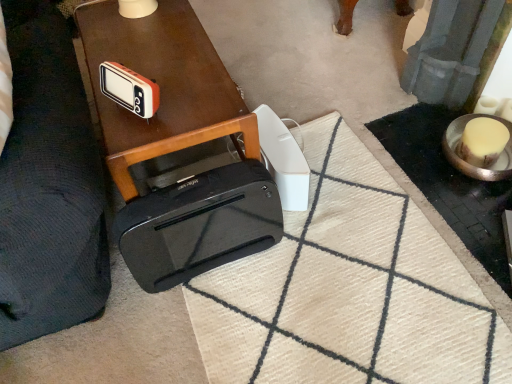
At what (x,y) coordinates should I click in order to perform the action: click on unoccupied space behind orange plastic radio at upper left, acting as the 1th gadget starting from the front. Please return your answer as a coordinate pair (x, y). This screenshot has width=512, height=384. Looking at the image, I should click on (157, 68).